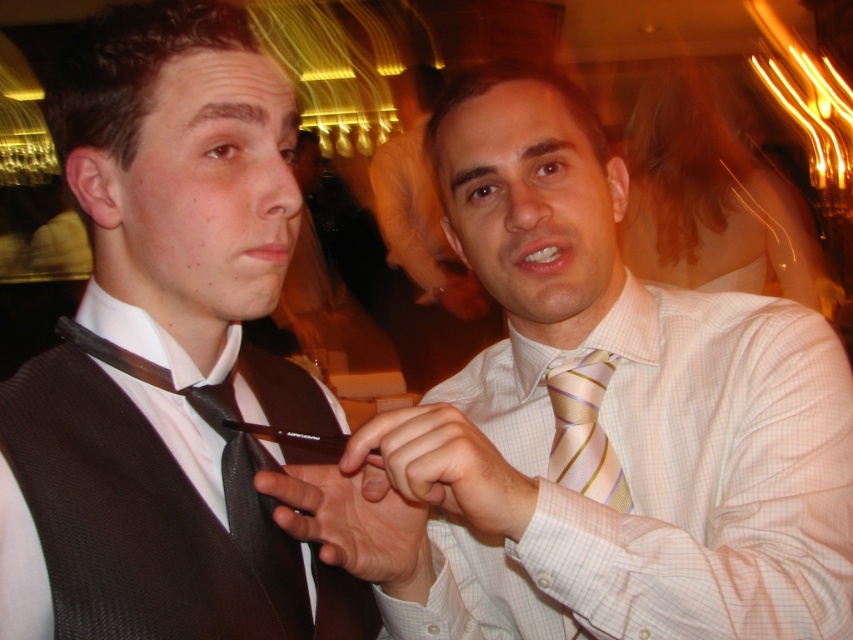
Question: Is matte black tie at left further to camera compared to pink striped tie at center?

Choices:
 (A) no
 (B) yes

Answer: (A)

Question: Which of the following is the closest to the observer?

Choices:
 (A) matte white shirt at center
 (B) matte black tie at center

Answer: (B)

Question: Is matte white shirt at center smaller than pink striped tie at center?

Choices:
 (A) yes
 (B) no

Answer: (B)

Question: Which of these objects is positioned closest to the matte black tie at left?

Choices:
 (A) matte black tie at center
 (B) matte white shirt at center

Answer: (A)

Question: Is matte black tie at center positioned behind pink striped tie at center?

Choices:
 (A) yes
 (B) no

Answer: (B)

Question: Which object appears farthest from the camera in this image?

Choices:
 (A) matte black tie at center
 (B) matte white shirt at center

Answer: (B)